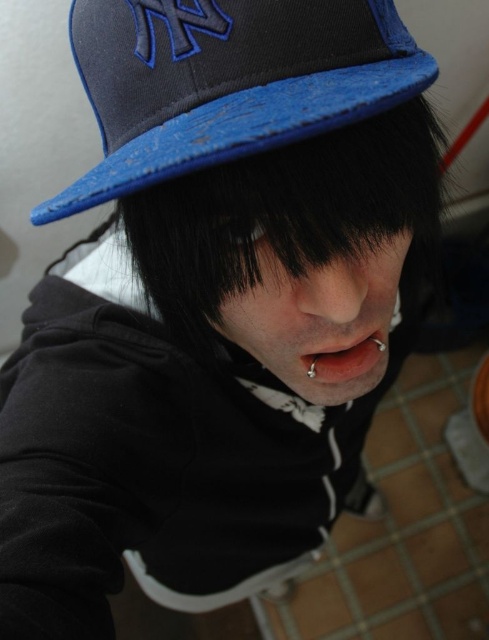
Question: Which of the following is the closest to the observer?

Choices:
 (A) blue fabric baseball cap at upper center
 (B) smooth flesh lips at center

Answer: (A)

Question: Is blue fabric baseball cap at upper center to the left of smooth flesh lips at center from the viewer's perspective?

Choices:
 (A) yes
 (B) no

Answer: (A)

Question: Can you confirm if blue fabric baseball cap at upper center is positioned below smooth flesh lips at center?

Choices:
 (A) yes
 (B) no

Answer: (B)

Question: Which object is closer to the camera taking this photo?

Choices:
 (A) blue fabric baseball cap at upper center
 (B) smooth flesh lips at center

Answer: (A)

Question: Is blue fabric baseball cap at upper center positioned at the back of smooth flesh lips at center?

Choices:
 (A) yes
 (B) no

Answer: (B)